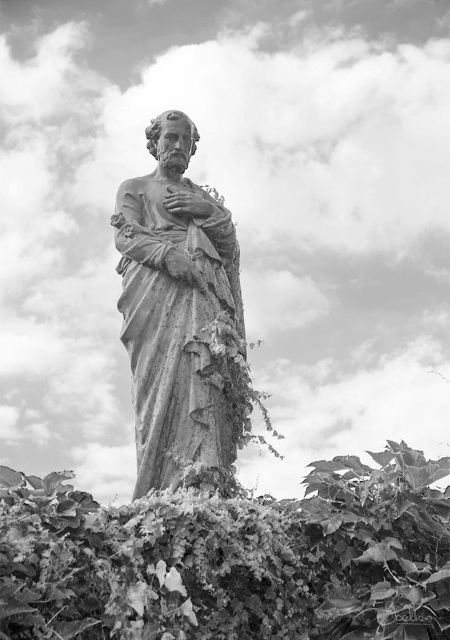
You are a landscape architect planning to place a new bench in the garden. The bench is 1.5 meters wide. You want to place it between the leathery green leaves at center and the stone statue at center. Is there enough space between them to fit the bench?

The distance between the leathery green leaves at center and the stone statue at center is 12.08 meters. Since the bench is only 1.5 meters wide, there is more than enough space to place it between them.

Consider the image. You are a botanist examining the statue and its surroundings. You notice the leathery green leaves at center. Where exactly are they located in terms of coordinates?

The leathery green leaves at center are located at coordinates point (232, 557).